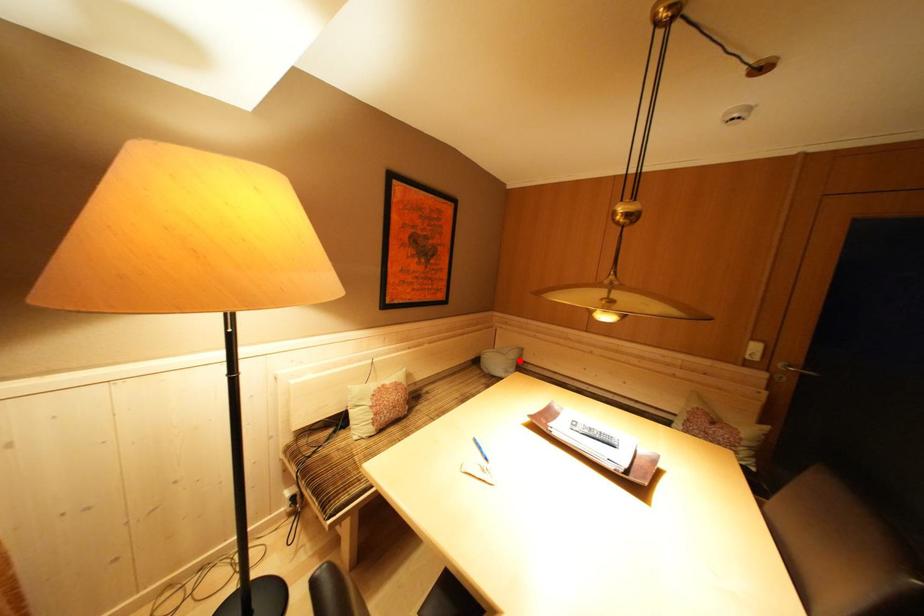
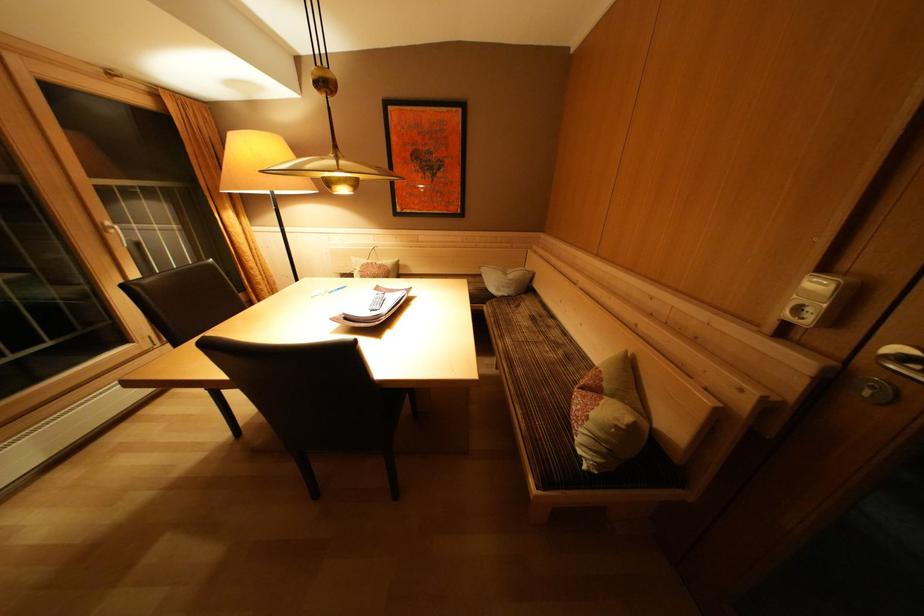
Question: I am providing you with two images of the same scene from different viewpoints. A red point is shown in image1. For the corresponding object point in image2, is it positioned nearer or farther from the camera?

Choices:
 (A) Nearer
 (B) Farther

Answer: (A)